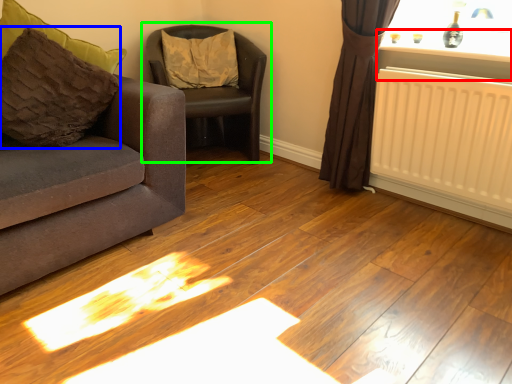
Question: Based on their relative distances, which object is farther from window sill (highlighted by a red box)? Choose from pillow (highlighted by a blue box) and chair (highlighted by a green box).

Choices:
 (A) pillow
 (B) chair

Answer: (A)